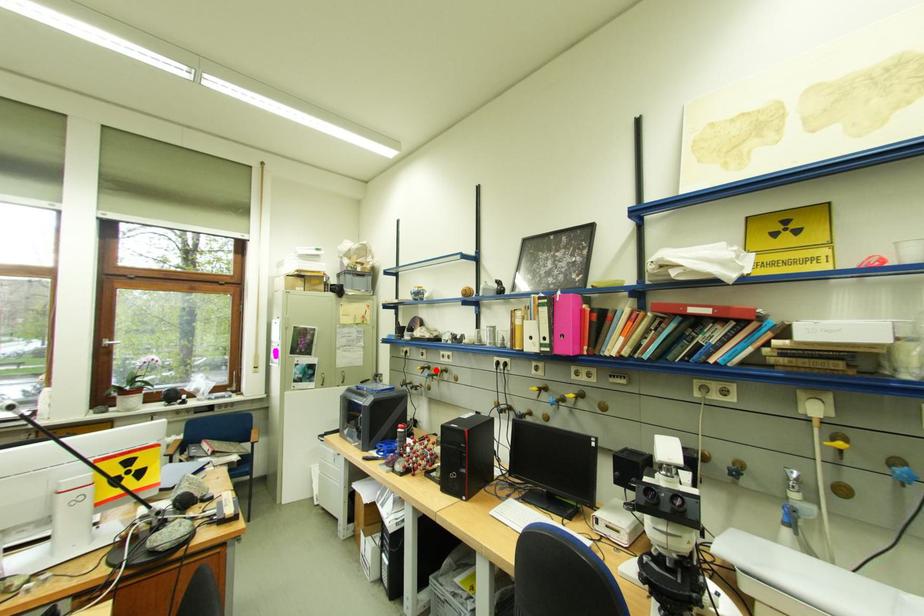
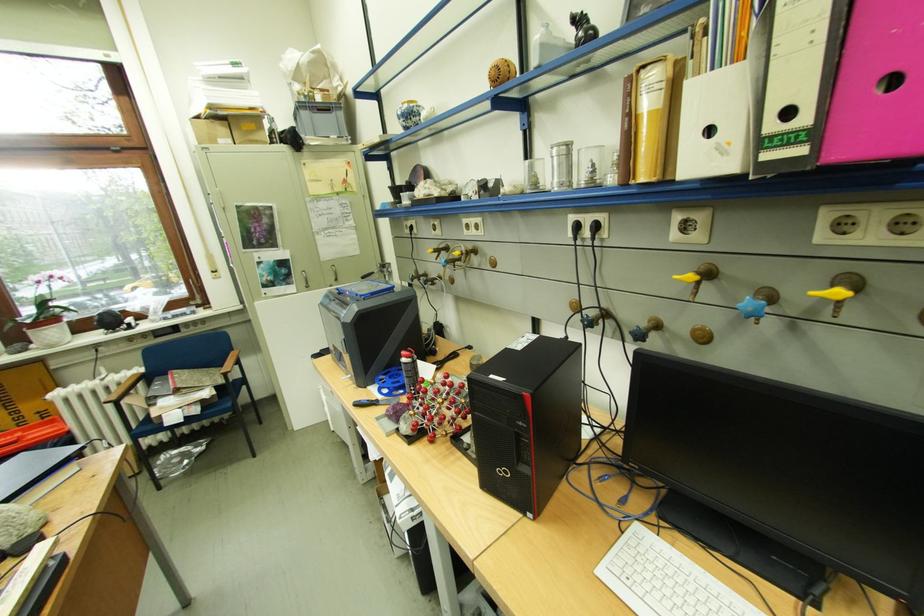
The point at the highlighted location is marked in the first image. Where is the corresponding point in the second image?

(453, 253)